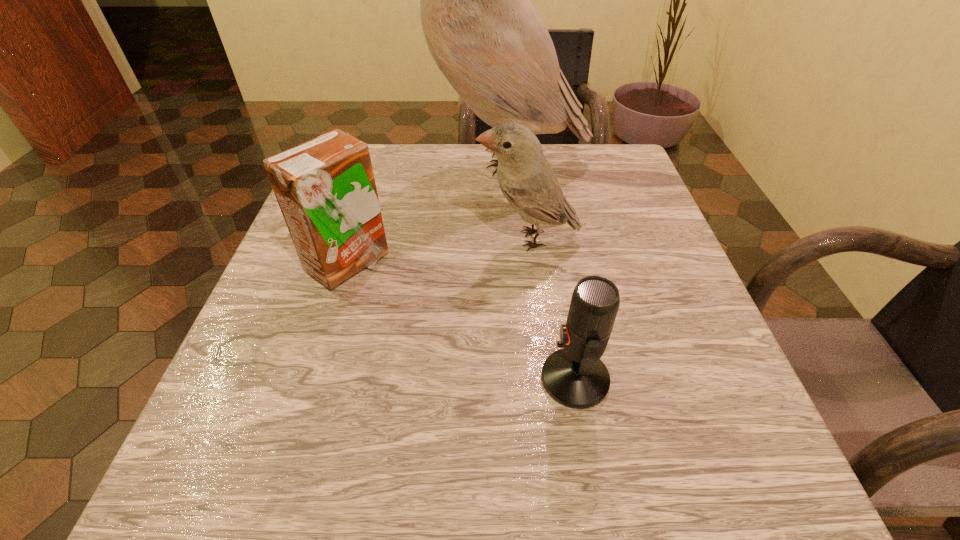
In the image, there is a desktop. In order to click on free region at the far edge in this screenshot , I will do (x=430, y=171).

The height and width of the screenshot is (540, 960). In the image, there is a desktop. Find the location of `vacant region at the near edge`. vacant region at the near edge is located at coordinates (558, 444).

In order to click on free spot at the left edge of the desktop in this screenshot , I will do `click(325, 408)`.

This screenshot has width=960, height=540. I want to click on vacant space at the right edge, so click(660, 401).

Where is `vacant space at the far left corner of the desktop`? The image size is (960, 540). vacant space at the far left corner of the desktop is located at coordinates (389, 186).

Where is `free space at the near right corner of the desktop`? The width and height of the screenshot is (960, 540). free space at the near right corner of the desktop is located at coordinates (687, 511).

Identify the location of free space between the nearest object and the carton. Image resolution: width=960 pixels, height=540 pixels. (461, 322).

Find the location of a particular element. This screenshot has width=960, height=540. vacant region between the microphone and the carton is located at coordinates (461, 322).

Locate an element on the screen. vacant area that lies between the microphone and the carton is located at coordinates (461, 322).

Where is `vacant area that lies between the carton and the microphone`? The image size is (960, 540). vacant area that lies between the carton and the microphone is located at coordinates (461, 322).